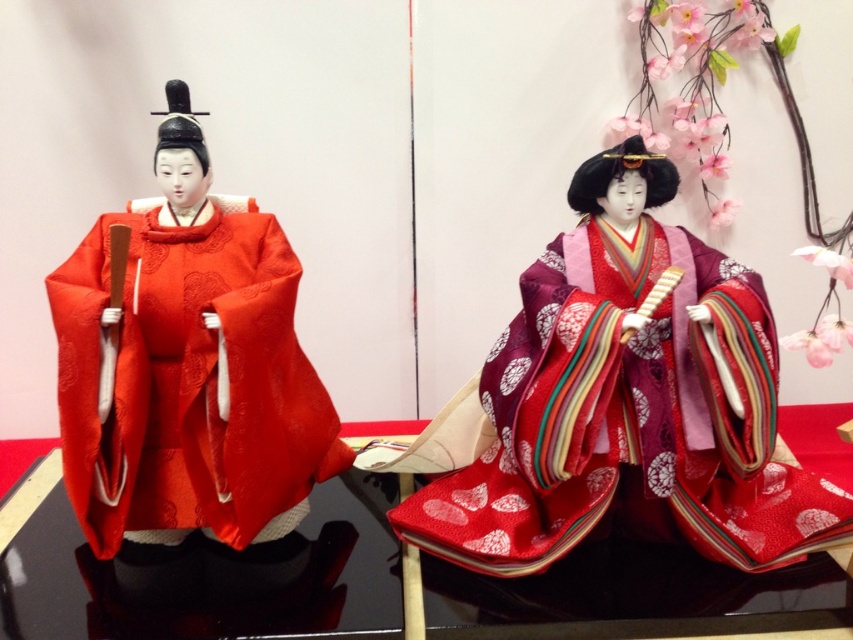
Based on the photo, how distant is silky red kimono at left from shiny black table at center?

They are 15.34 inches apart.

Who is lower down, silky red kimono at left or shiny black table at center?

Positioned lower is shiny black table at center.

Measure the distance between silky red kimono at left and camera.

1.01 meters

Locate an element on the screen. The height and width of the screenshot is (640, 853). silky red kimono at left is located at coordinates (187, 365).

Can you confirm if silky red kimono at center is shorter than shiny black table at center?

In fact, silky red kimono at center may be taller than shiny black table at center.

Between point (672, 337) and point (842, 563), which one is positioned in front?

Point (672, 337) is in front.

Describe the element at coordinates (628, 401) in the screenshot. I see `silky red kimono at center` at that location.

Where is `silky red kimono at center`? silky red kimono at center is located at coordinates (628, 401).

Can you confirm if silky red kimono at center is positioned to the left of silky red kimono at left?

No, silky red kimono at center is not to the left of silky red kimono at left.

Between point (653, 200) and point (257, 240), which one is positioned in front?

Point (257, 240)

Find the location of `silky red kimono at center`. silky red kimono at center is located at coordinates (628, 401).

Where is `silky red kimono at center`? Image resolution: width=853 pixels, height=640 pixels. silky red kimono at center is located at coordinates (628, 401).